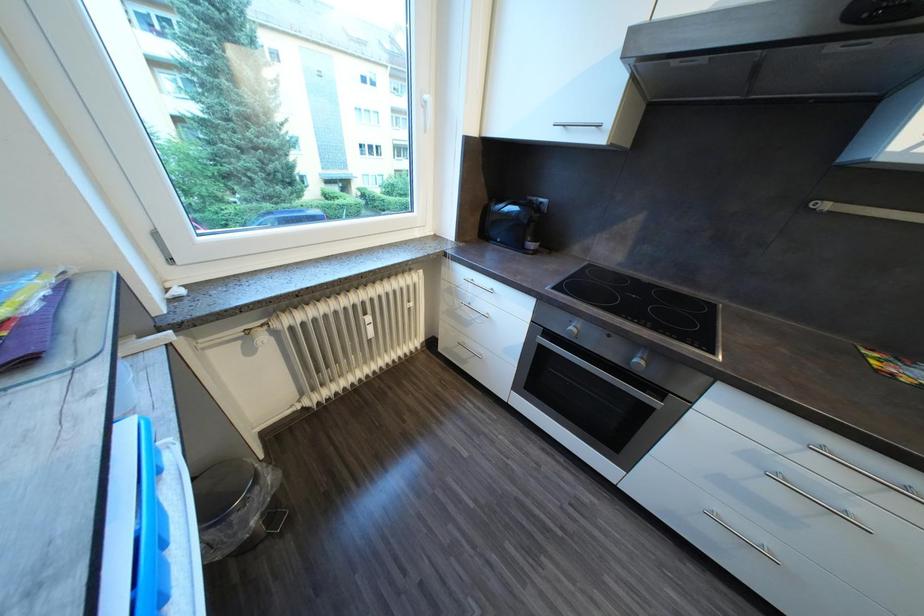
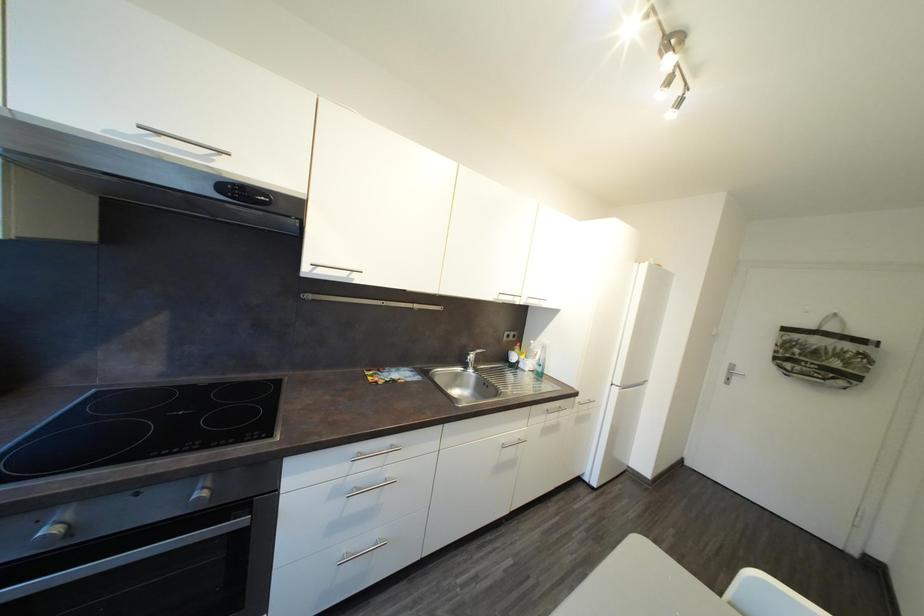
Question: How did the camera likely rotate?

Choices:
 (A) Left
 (B) Right
 (C) Up
 (D) Down

Answer: (B)